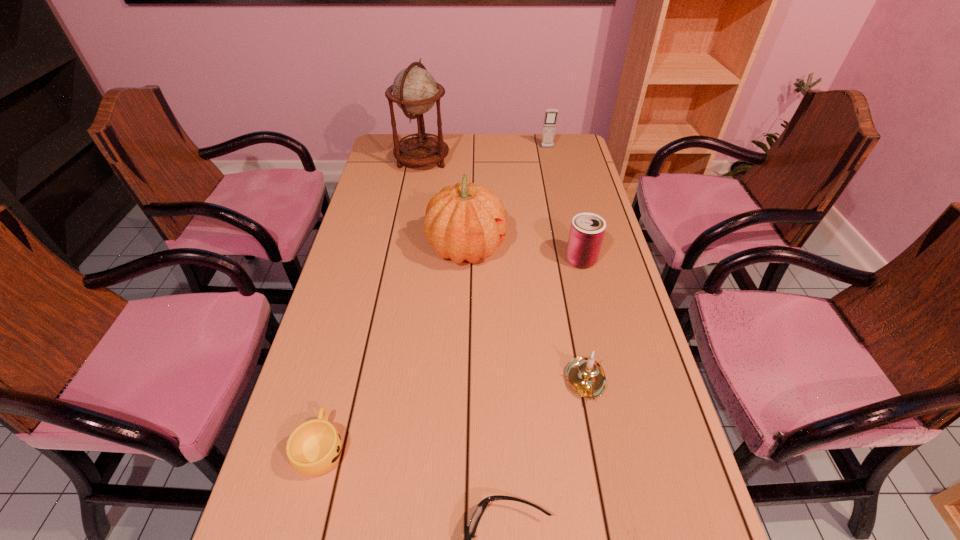
This screenshot has width=960, height=540. What are the coordinates of `vacant point located 0.070m on the front-facing side of the cellular telephone` in the screenshot? It's located at (550, 158).

Locate an element on the screen. This screenshot has width=960, height=540. free space located on the left of the fourth shortest object is located at coordinates (545, 260).

This screenshot has height=540, width=960. In order to click on vacant space located on the handle side of the third nearest object in this screenshot , I will do `click(610, 504)`.

Where is `vacant space located 0.200m on the right of the second nearest object`? This screenshot has height=540, width=960. vacant space located 0.200m on the right of the second nearest object is located at coordinates (442, 448).

This screenshot has height=540, width=960. In order to click on globe at the far edge in this screenshot , I will do `click(415, 91)`.

Locate an element on the screen. cellular telephone located at the far edge is located at coordinates (550, 119).

Identify the location of globe present at the left edge. (415, 91).

Identify the location of cup that is at the left edge. The width and height of the screenshot is (960, 540). (313, 448).

Identify the location of cellular telephone that is at the right edge. The width and height of the screenshot is (960, 540). (550, 119).

What are the coordinates of `can positioned at the right edge` in the screenshot? It's located at (587, 230).